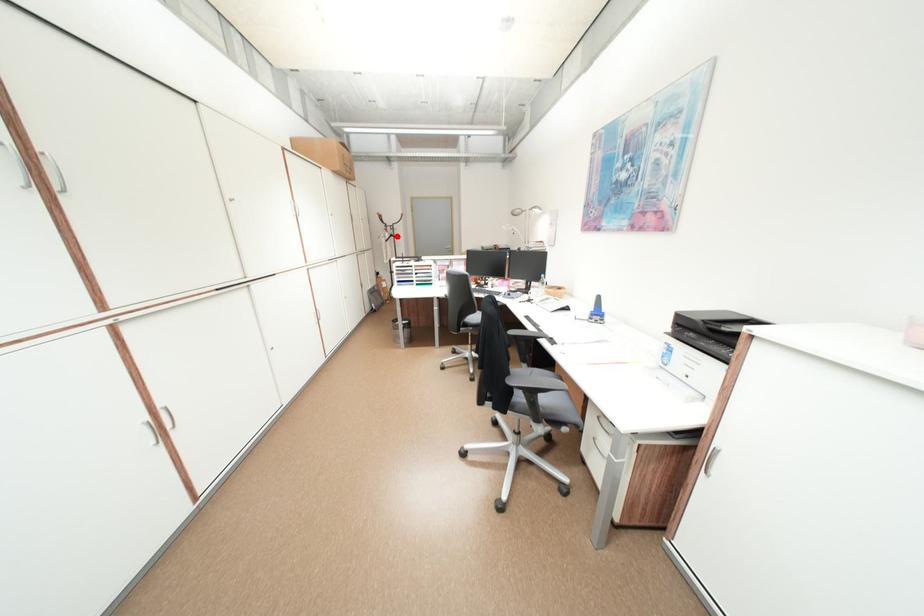
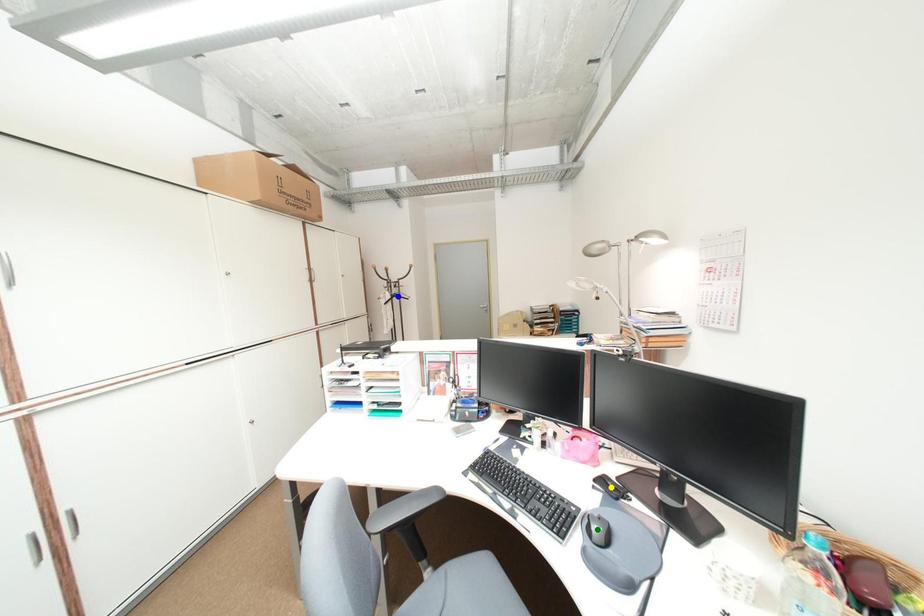
Question: I am providing you with two images of the same scene from different viewpoints. A red point is marked on the first image. You are given multiple points on the second image. In image 2, which mark is for the same physical point as the one in image 1?

Choices:
 (A) blue point
 (B) green point
 (C) yellow point

Answer: (A)